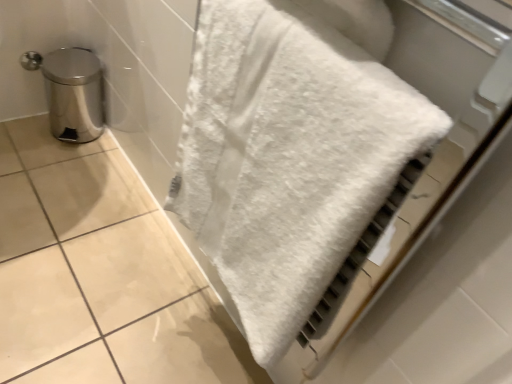
I want to click on white fluffy towel at center, so click(288, 157).

What do you see at coordinates (288, 157) in the screenshot? The height and width of the screenshot is (384, 512). I see `white fluffy towel at center` at bounding box center [288, 157].

At what (x,y) coordinates should I click in order to perform the action: click on white fluffy towel at center. Please return your answer as a coordinate pair (x, y). The image size is (512, 384). Looking at the image, I should click on (288, 157).